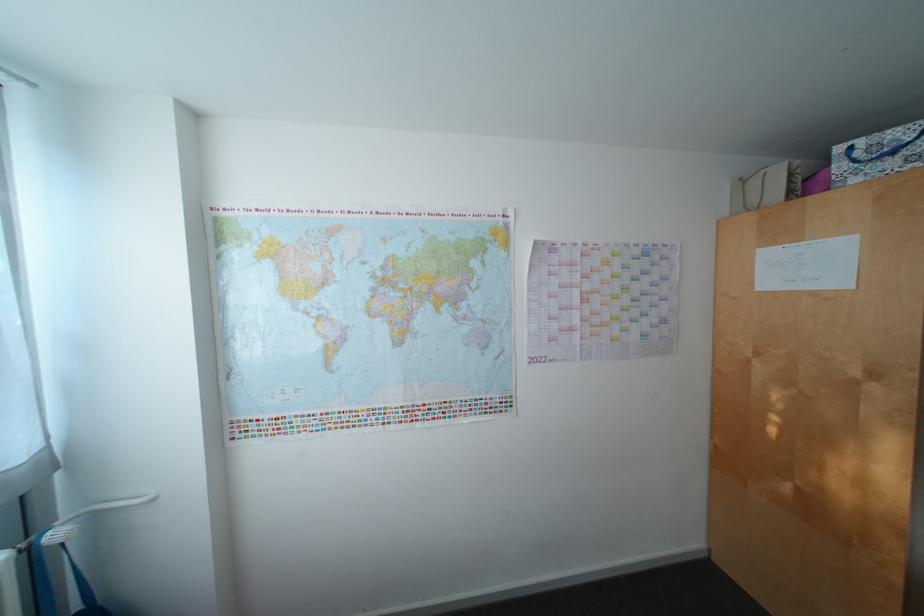
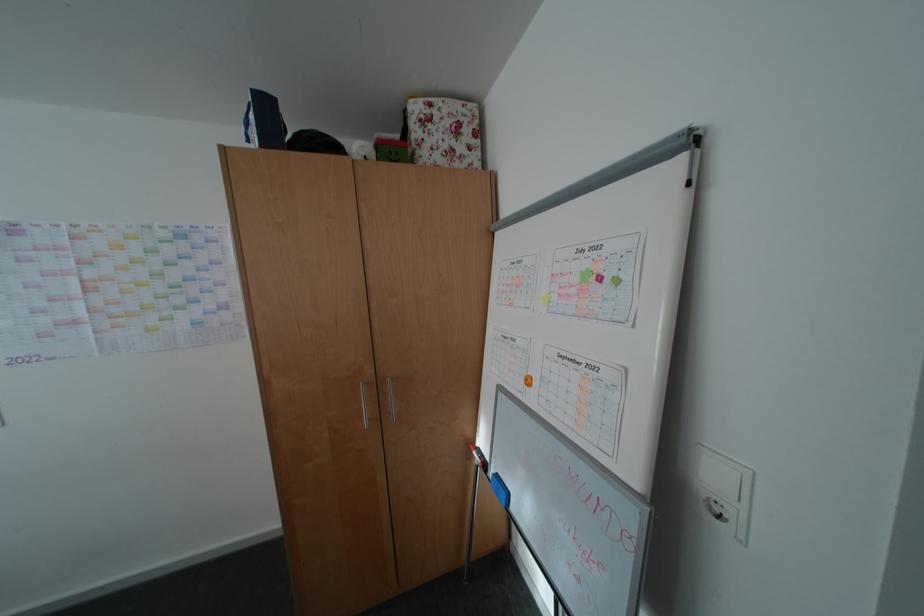
Question: The images are taken continuously from a first-person perspective. In which direction are you moving?

Choices:
 (A) Left
 (B) Right
 (C) Forward
 (D) Backward

Answer: (B)